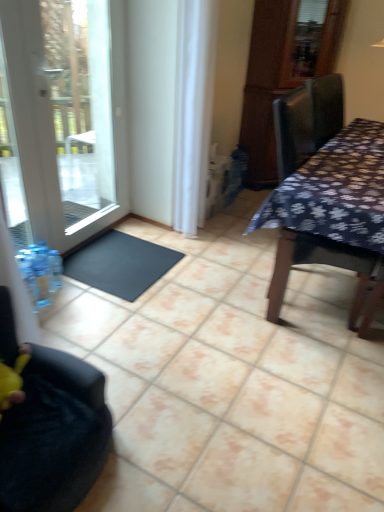
You are a GUI agent. You are given a task and a screenshot of the screen. Output one action in this format:
    pyautogui.click(x=<x>, y=<y>)
    Task: Click on the free spot in front of black rubber doormat at lower left
    
    Given the screenshot: What is the action you would take?
    pyautogui.click(x=127, y=324)